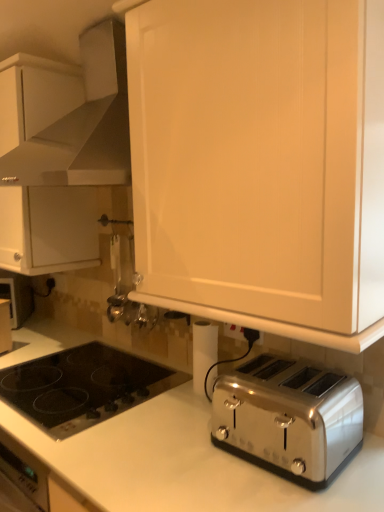
This screenshot has height=512, width=384. What do you see at coordinates (289, 418) in the screenshot?
I see `satin chrome toaster at lower right` at bounding box center [289, 418].

Describe the element at coordinates (234, 331) in the screenshot. I see `white plastic electric outlet at lower center` at that location.

The width and height of the screenshot is (384, 512). Describe the element at coordinates (261, 164) in the screenshot. I see `white matte cabinet at upper center, which is the 2th cabinetry in back-to-front order` at that location.

This screenshot has width=384, height=512. Describe the element at coordinates (83, 387) in the screenshot. I see `black glass cooktop at lower left` at that location.

This screenshot has height=512, width=384. What do you see at coordinates (35, 120) in the screenshot? I see `white matte cabinet at upper left, the second cabinetry viewed from the right` at bounding box center [35, 120].

Image resolution: width=384 pixels, height=512 pixels. Identify the location of satin chrome toaster at lower right. (289, 418).

Between white plastic electric outlet at lower center and white matte cabinet at upper center, which is the 2th cabinetry in back-to-front order, which one has larger size?

With larger size is white matte cabinet at upper center, which is the 2th cabinetry in back-to-front order.

Is white plastic electric outlet at lower center further to camera compared to white matte cabinet at upper center, which is counted as the first cabinetry, starting from the front?

Yes, it is behind white matte cabinet at upper center, which is counted as the first cabinetry, starting from the front.

Considering the relative sizes of white plastic electric outlet at lower center and white matte cabinet at upper center, the second cabinetry in the left-to-right sequence, in the image provided, is white plastic electric outlet at lower center wider than white matte cabinet at upper center, the second cabinetry in the left-to-right sequence,?

In fact, white plastic electric outlet at lower center might be narrower than white matte cabinet at upper center, the second cabinetry in the left-to-right sequence.

Does satin white range hood at upper center have a lesser height compared to satin chrome toaster at lower right?

No, satin white range hood at upper center is not shorter than satin chrome toaster at lower right.

Which object is positioned more to the left, satin white range hood at upper center or satin chrome toaster at lower right?

satin white range hood at upper center is more to the left.

Consider the image. Considering the relative sizes of satin white range hood at upper center and satin chrome toaster at lower right in the image provided, is satin white range hood at upper center thinner than satin chrome toaster at lower right?

No, satin white range hood at upper center is not thinner than satin chrome toaster at lower right.

Is satin white range hood at upper center at the back of black glass cooktop at lower left?

black glass cooktop at lower left is not turned away from satin white range hood at upper center.

Can you confirm if black glass cooktop at lower left is bigger than satin white range hood at upper center?

Actually, black glass cooktop at lower left might be smaller than satin white range hood at upper center.

From the image's perspective, is satin white range hood at upper center above white plastic electric outlet at lower center?

Yes, from the image's perspective, satin white range hood at upper center is on top of white plastic electric outlet at lower center.

Does point (117, 133) come behind point (229, 335)?

Yes, point (117, 133) is behind point (229, 335).

Which is in front, satin white range hood at upper center or white plastic electric outlet at lower center?

satin white range hood at upper center is in front.

Which of these two, satin white range hood at upper center or white plastic electric outlet at lower center, is smaller?

white plastic electric outlet at lower center.

Can you confirm if white plastic electric outlet at lower center is smaller than black glass cooktop at lower left?

Yes, white plastic electric outlet at lower center is smaller than black glass cooktop at lower left.

From a real-world perspective, does white plastic electric outlet at lower center sit lower than black glass cooktop at lower left?

Actually, white plastic electric outlet at lower center is physically above black glass cooktop at lower left in the real world.

Considering the positions of point (224, 330) and point (20, 404), is point (224, 330) closer or farther from the camera than point (20, 404)?

Point (224, 330) appears to be farther away from the viewer than point (20, 404).

Is white plastic electric outlet at lower center with black glass cooktop at lower left?

white plastic electric outlet at lower center is not next to black glass cooktop at lower left, and they're not touching.

Is white plastic electric outlet at lower center not within white matte cabinet at upper left, placed as the 2th cabinetry when sorted from front to back?

Indeed, white plastic electric outlet at lower center is completely outside white matte cabinet at upper left, placed as the 2th cabinetry when sorted from front to back.

Is white plastic electric outlet at lower center aimed at white matte cabinet at upper left, which is the 1th cabinetry in back-to-front order?

No, white plastic electric outlet at lower center is not oriented towards white matte cabinet at upper left, which is the 1th cabinetry in back-to-front order.

In terms of width, does white plastic electric outlet at lower center look wider or thinner when compared to white matte cabinet at upper left, placed as the 2th cabinetry when sorted from front to back?

In the image, white plastic electric outlet at lower center appears to be more narrow than white matte cabinet at upper left, placed as the 2th cabinetry when sorted from front to back.

In the scene shown: From a real-world perspective, which object stands above the other?

In real-world perspective, white matte cabinet at upper left, the second cabinetry viewed from the right, is above.

Is white matte cabinet at upper left, placed as the 1th cabinetry when sorted from left to right, inside black glass cooktop at lower left?

Actually, white matte cabinet at upper left, placed as the 1th cabinetry when sorted from left to right, is outside black glass cooktop at lower left.

Considering the positions of points (133, 394) and (37, 163), is point (133, 394) closer to camera compared to point (37, 163)?

That is False.

Which of these two, black glass cooktop at lower left or white matte cabinet at upper left, which is the 1th cabinetry in back-to-front order, is wider?

black glass cooktop at lower left.

Where is `electric outlet behind the white matte cabinet at upper center, which appears as the 1th cabinetry when viewed from the right`? Image resolution: width=384 pixels, height=512 pixels. electric outlet behind the white matte cabinet at upper center, which appears as the 1th cabinetry when viewed from the right is located at coordinates (234, 331).

Find the location of a particular element. The height and width of the screenshot is (512, 384). home appliance on the left of satin chrome toaster at lower right is located at coordinates (67, 115).

Estimate the real-world distances between objects in this image. Which object is closer to white plastic electric outlet at lower center, white matte cabinet at upper left, placed as the 2th cabinetry when sorted from front to back, or white matte cabinet at upper center, which is counted as the first cabinetry, starting from the front?

Among the two, white matte cabinet at upper center, which is counted as the first cabinetry, starting from the front, is located nearer to white plastic electric outlet at lower center.

Based on their spatial positions, is white matte cabinet at upper left, the second cabinetry viewed from the right, or white matte cabinet at upper center, which appears as the 1th cabinetry when viewed from the right, further from black glass cooktop at lower left?

Among the two, white matte cabinet at upper center, which appears as the 1th cabinetry when viewed from the right, is located further to black glass cooktop at lower left.

Looking at the image, which one is located closer to black glass cooktop at lower left, white plastic electric outlet at lower center or satin white range hood at upper center?

white plastic electric outlet at lower center is positioned closer to the anchor black glass cooktop at lower left.

Considering their positions, is white matte cabinet at upper left, placed as the 1th cabinetry when sorted from left to right, positioned further to satin white range hood at upper center than satin chrome toaster at lower right?

Among the two, satin chrome toaster at lower right is located further to satin white range hood at upper center.

Considering their positions, is white matte cabinet at upper left, which is the 1th cabinetry in back-to-front order, positioned further to white plastic electric outlet at lower center than satin white range hood at upper center?

The object further to white plastic electric outlet at lower center is white matte cabinet at upper left, which is the 1th cabinetry in back-to-front order.

Looking at the image, which one is located closer to white matte cabinet at upper center, the second cabinetry in the left-to-right sequence, satin chrome toaster at lower right or white matte cabinet at upper left, which is the 1th cabinetry in back-to-front order?

satin chrome toaster at lower right is positioned closer to the anchor white matte cabinet at upper center, the second cabinetry in the left-to-right sequence.

Looking at the image, which one is located further to satin white range hood at upper center, satin chrome toaster at lower right or white matte cabinet at upper left, the second cabinetry viewed from the right?

Based on the image, satin chrome toaster at lower right appears to be further to satin white range hood at upper center.

Based on their spatial positions, is white plastic electric outlet at lower center or white matte cabinet at upper center, which is counted as the first cabinetry, starting from the front, closer to white matte cabinet at upper left, the second cabinetry viewed from the right?

white matte cabinet at upper center, which is counted as the first cabinetry, starting from the front, is closer to white matte cabinet at upper left, the second cabinetry viewed from the right.

What are the coordinates of `toaster positioned between white matte cabinet at upper center, which is counted as the first cabinetry, starting from the front, and white plastic electric outlet at lower center from near to far` in the screenshot? It's located at (289, 418).

You are a GUI agent. You are given a task and a screenshot of the screen. Output one action in this format:
    pyautogui.click(x=<x>, y=<y>)
    Task: Click on the electric outlet between white matte cabinet at upper left, placed as the 1th cabinetry when sorted from left to right, and satin chrome toaster at lower right
    
    Given the screenshot: What is the action you would take?
    pyautogui.click(x=234, y=331)

What are the coordinates of `home appliance between white matte cabinet at upper left, placed as the 1th cabinetry when sorted from left to right, and white plastic electric outlet at lower center from left to right` in the screenshot? It's located at (67, 115).

Identify the location of electric outlet between white matte cabinet at upper left, placed as the 2th cabinetry when sorted from front to back, and white matte cabinet at upper center, which is the 2th cabinetry in back-to-front order, from left to right. (234, 331).